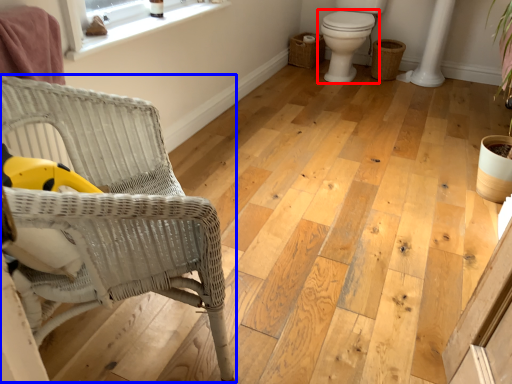
Question: Which of the following is the farthest to the observer, toilet (highlighted by a red box) or chair (highlighted by a blue box)?

Choices:
 (A) toilet
 (B) chair

Answer: (A)